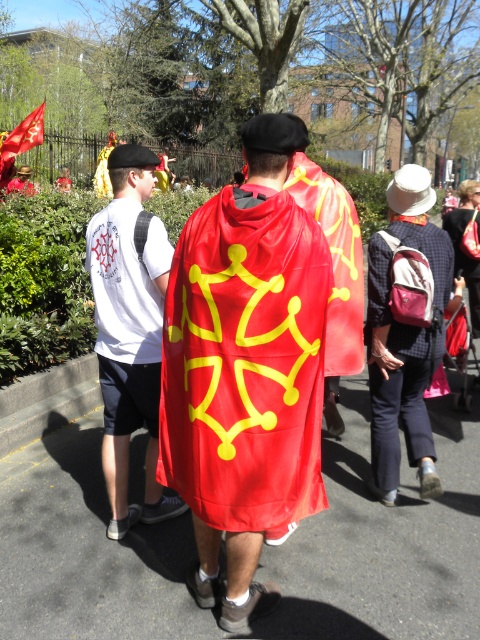
Question: Does matte red cape at center appear over red fabric flag at upper left?

Choices:
 (A) no
 (B) yes

Answer: (A)

Question: Does shiny red cape at center appear under red fabric flag at upper left?

Choices:
 (A) yes
 (B) no

Answer: (A)

Question: Is matte red cape at center bigger than red satin cape at center?

Choices:
 (A) yes
 (B) no

Answer: (B)

Question: Estimate the real-world distances between objects in this image. Which object is farther from the red fabric flag at upper left?

Choices:
 (A) shiny red cape at center
 (B) white t-shirt at left
 (C) matte red cape at center

Answer: (A)

Question: Among these objects, which one is farthest from the camera?

Choices:
 (A) shiny red cape at center
 (B) white t-shirt at left
 (C) red fabric flag at upper left

Answer: (C)

Question: Estimate the real-world distances between objects in this image. Which object is closer to the shiny red cape at center?

Choices:
 (A) white t-shirt at left
 (B) red satin cape at center

Answer: (A)